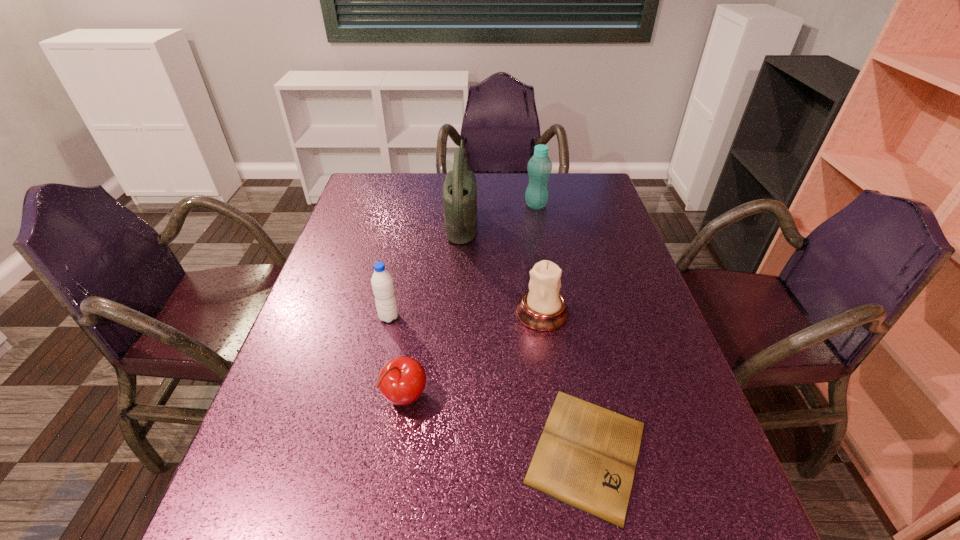
At what (x,y) coordinates should I click in order to perform the action: click on vacant space that is in between the candle holder and the shorter water bottle. Please return your answer as a coordinate pair (x, y). Looking at the image, I should click on (466, 315).

Identify which object is the nearest to the cherry. Please provide its 2D coordinates. Your answer should be formatted as a tuple, i.e. [(x, y)], where the tuple contains the x and y coordinates of a point satisfying the conditions above.

[(382, 283)]

Where is `object that is the fifth closest one to the book`? The width and height of the screenshot is (960, 540). object that is the fifth closest one to the book is located at coordinates (539, 167).

In order to click on vacant area in the image that satisfies the following two spatial constraints: 1. on the spout of the shortest object; 2. on the right side of the watering can in this screenshot , I will do (x=448, y=451).

You are a GUI agent. You are given a task and a screenshot of the screen. Output one action in this format:
    pyautogui.click(x=<x>, y=<y>)
    Task: Click on the free space that satisfies the following two spatial constraints: 1. at the front cap of the taller water bottle; 2. on the left side of the shortest object
    This screenshot has width=960, height=540.
    Given the screenshot: What is the action you would take?
    pyautogui.click(x=580, y=451)

Where is `vacant position in the image that satisfies the following two spatial constraints: 1. on the spout of the watering can; 2. on the front side of the nearer water bottle`? The image size is (960, 540). vacant position in the image that satisfies the following two spatial constraints: 1. on the spout of the watering can; 2. on the front side of the nearer water bottle is located at coordinates (456, 317).

Where is `free space that satisfies the following two spatial constraints: 1. on the spout of the watering can; 2. on the left side of the candle holder`? This screenshot has height=540, width=960. free space that satisfies the following two spatial constraints: 1. on the spout of the watering can; 2. on the left side of the candle holder is located at coordinates (456, 313).

The height and width of the screenshot is (540, 960). Identify the location of vacant region that satisfies the following two spatial constraints: 1. on the front side of the shorter water bottle; 2. on the right side of the book. (360, 451).

I want to click on vacant region that satisfies the following two spatial constraints: 1. on the spout of the shortest object; 2. on the left side of the watering can, so click(448, 451).

Where is `vacant area in the image that satisfies the following two spatial constraints: 1. on the back side of the candle holder; 2. on the spout of the watering can`? vacant area in the image that satisfies the following two spatial constraints: 1. on the back side of the candle holder; 2. on the spout of the watering can is located at coordinates coord(528,219).